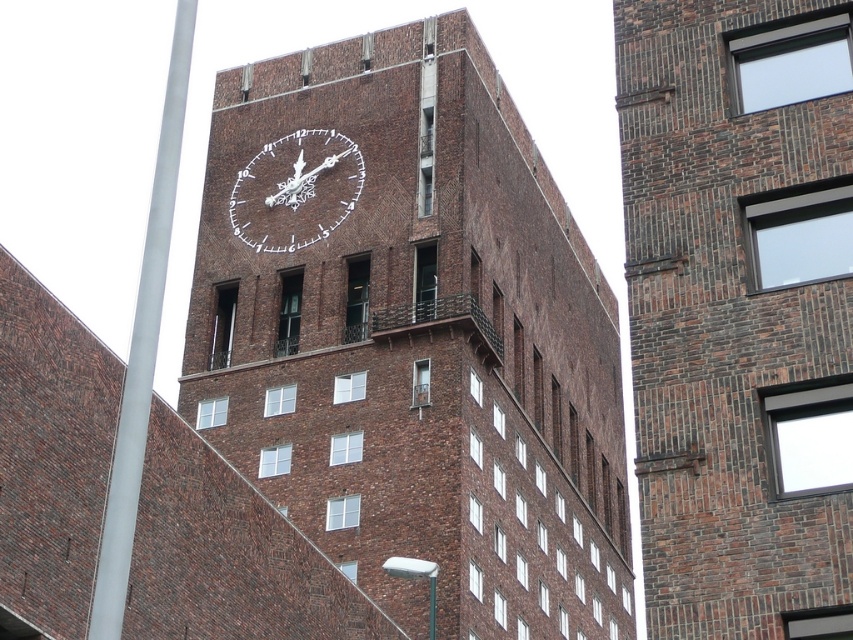
Question: Which of the following is the farthest from the observer?

Choices:
 (A) metallic silver clock at center
 (B) smooth metallic pole at left

Answer: (A)

Question: Does brown brick building at upper center appear on the left side of smooth metallic pole at left?

Choices:
 (A) yes
 (B) no

Answer: (B)

Question: Observing the image, what is the correct spatial positioning of brown brick clock tower at center in reference to smooth metallic pole at left?

Choices:
 (A) right
 (B) left

Answer: (A)

Question: Which of these objects is positioned farthest from the metallic silver clock at center?

Choices:
 (A) brown brick clock tower at center
 (B) smooth metallic pole at left
 (C) brown brick building at upper center

Answer: (B)

Question: Does brown brick clock tower at center have a greater width compared to brown brick building at upper center?

Choices:
 (A) yes
 (B) no

Answer: (A)

Question: Which of the following is the closest to the observer?

Choices:
 (A) click(x=338, y=204)
 (B) click(x=723, y=445)

Answer: (B)